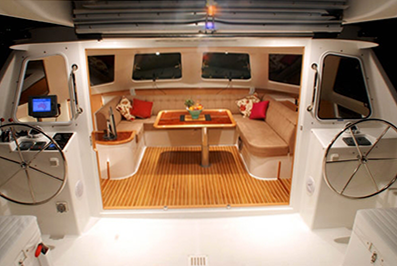
Identify the location of table. The height and width of the screenshot is (266, 397). (196, 125).